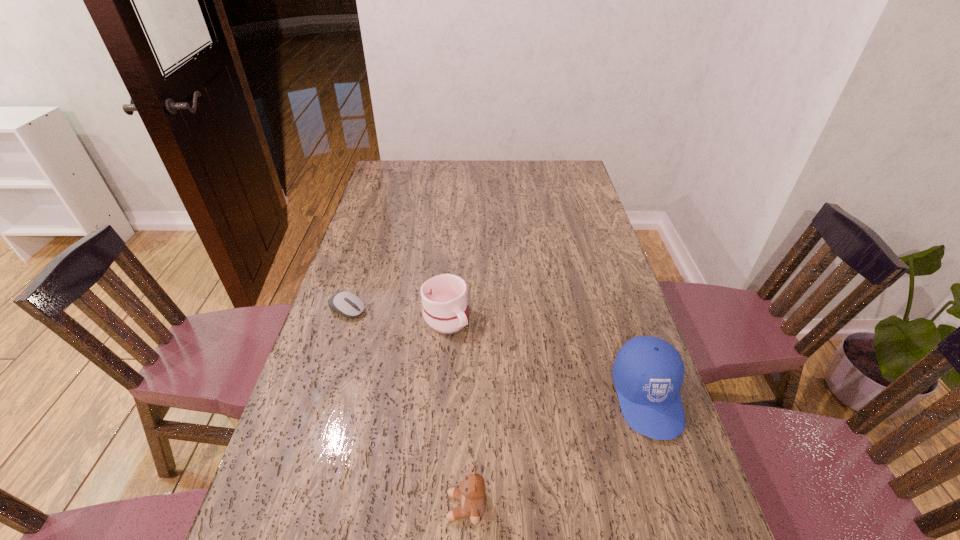
I want to click on teddy bear, so click(x=470, y=492).

You are a GUI agent. You are given a task and a screenshot of the screen. Output one action in this format:
    pyautogui.click(x=<x>, y=<y>)
    Task: Click on the rightmost object
    The image size is (960, 540).
    Given the screenshot: What is the action you would take?
    pyautogui.click(x=648, y=372)

This screenshot has width=960, height=540. Identify the location of the third farthest object. (648, 372).

Where is `mug`? The height and width of the screenshot is (540, 960). mug is located at coordinates (444, 297).

In order to click on the shortest object in this screenshot , I will do `click(347, 304)`.

In order to click on the leftmost object in this screenshot , I will do (x=347, y=304).

What are the coordinates of `vacant space positioned 0.170m on the front-facing side of the nearest object` in the screenshot? It's located at (363, 507).

Locate an element on the screen. The width and height of the screenshot is (960, 540). vacant point located on the front-facing side of the nearest object is located at coordinates (418, 507).

Image resolution: width=960 pixels, height=540 pixels. In order to click on vacant region located on the front-facing side of the nearest object in this screenshot , I will do `click(383, 507)`.

I want to click on vacant region located on the front-facing side of the second nearest object, so click(681, 498).